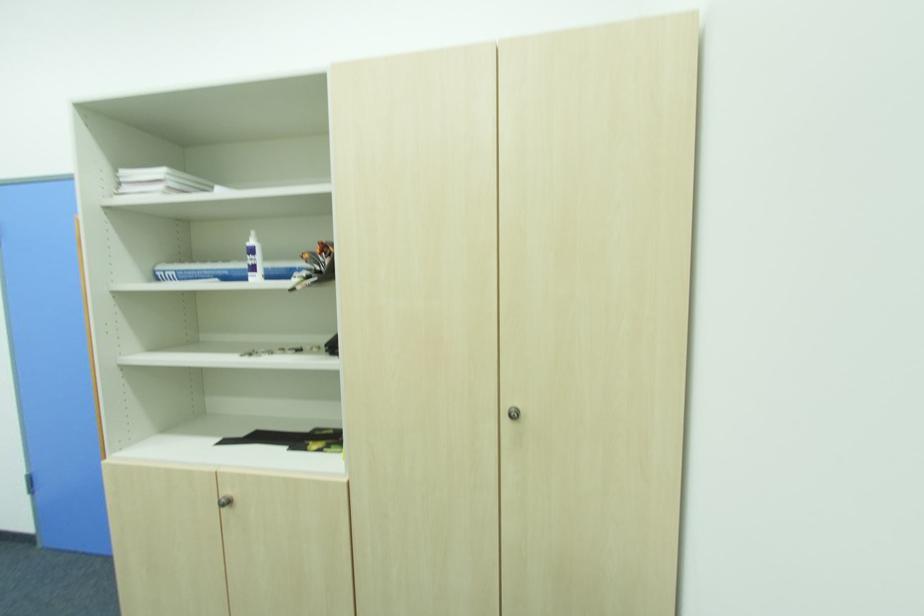
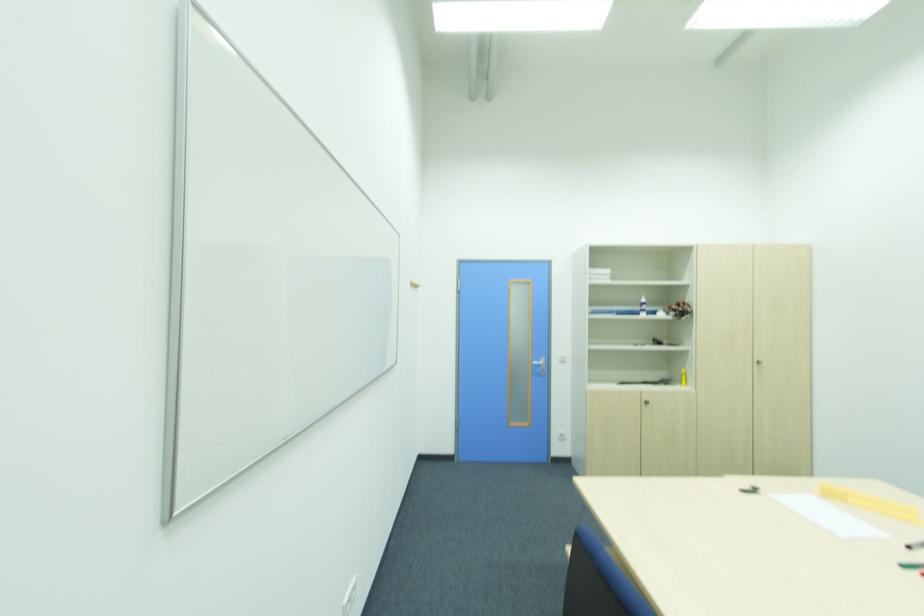
Locate, in the second image, the point that corresponds to the point at 229,504 in the first image.

(650, 402)